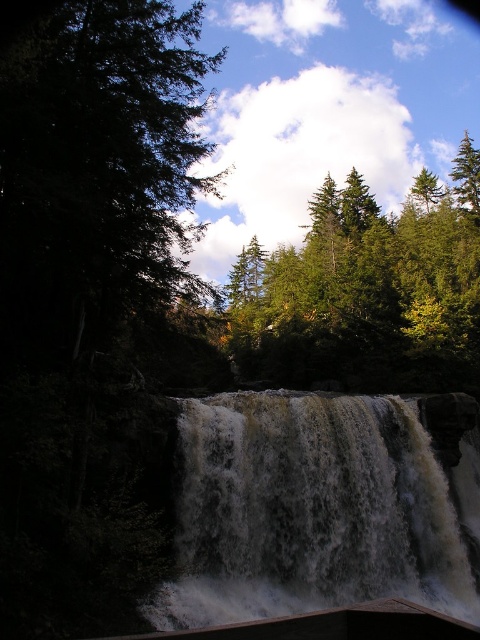
Question: Is white frothy water at center below green matte tree at upper right?

Choices:
 (A) no
 (B) yes

Answer: (B)

Question: Which object appears farthest from the camera in this image?

Choices:
 (A) green leafy tree at left
 (B) green matte tree at upper right

Answer: (B)

Question: Is white frothy water at center wider than green matte tree at upper center?

Choices:
 (A) no
 (B) yes

Answer: (A)

Question: Does green leafy tree at left appear over green matte tree at upper right?

Choices:
 (A) no
 (B) yes

Answer: (B)

Question: Which of the following is the closest to the observer?

Choices:
 (A) green matte tree at upper right
 (B) green leafy tree at left

Answer: (B)

Question: Estimate the real-world distances between objects in this image. Which object is closer to the green leafy tree at left?

Choices:
 (A) green matte tree at upper center
 (B) green matte tree at upper right

Answer: (A)